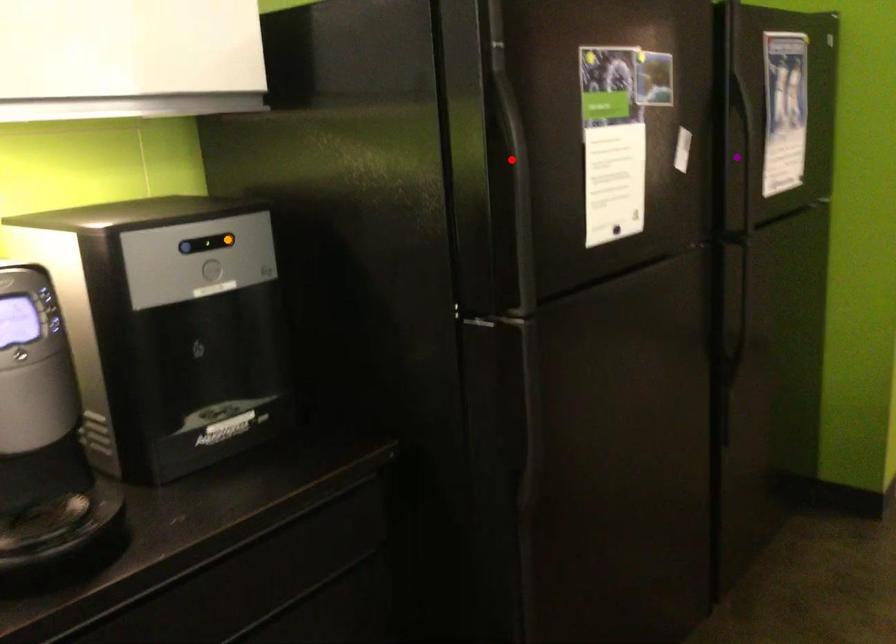
Order these from nearest to farthest:
purple point | orange point | red point

red point < orange point < purple point